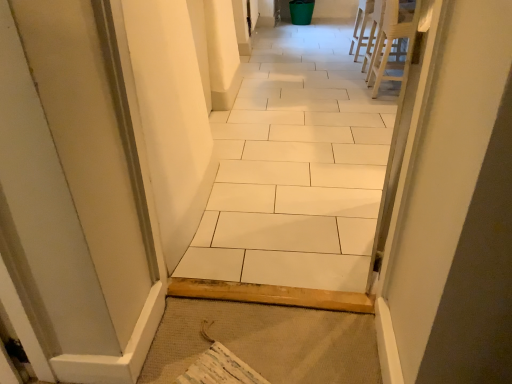
Question: In the image, is white ceramic tile at center on the left side or the right side of white plastic chair at upper right, the 1th chair when ordered from front to back?

Choices:
 (A) left
 (B) right

Answer: (A)

Question: From a real-world perspective, is white ceramic tile at center above or below white plastic chair at upper right, the 1th chair when ordered from front to back?

Choices:
 (A) below
 (B) above

Answer: (B)

Question: Estimate the real-world distances between objects in this image. Which object is farther from the white plastic chair at upper right, which appears as the first chair when viewed from the back?

Choices:
 (A) white plastic chair at upper right, the 1th chair when ordered from front to back
 (B) white ceramic tile at center

Answer: (B)

Question: Estimate the real-world distances between objects in this image. Which object is closer to the white ceramic tile at center?

Choices:
 (A) white plastic chair at upper right, placed as the 2th chair when sorted from back to front
 (B) white plastic chair at upper right, which appears as the first chair when viewed from the back

Answer: (A)